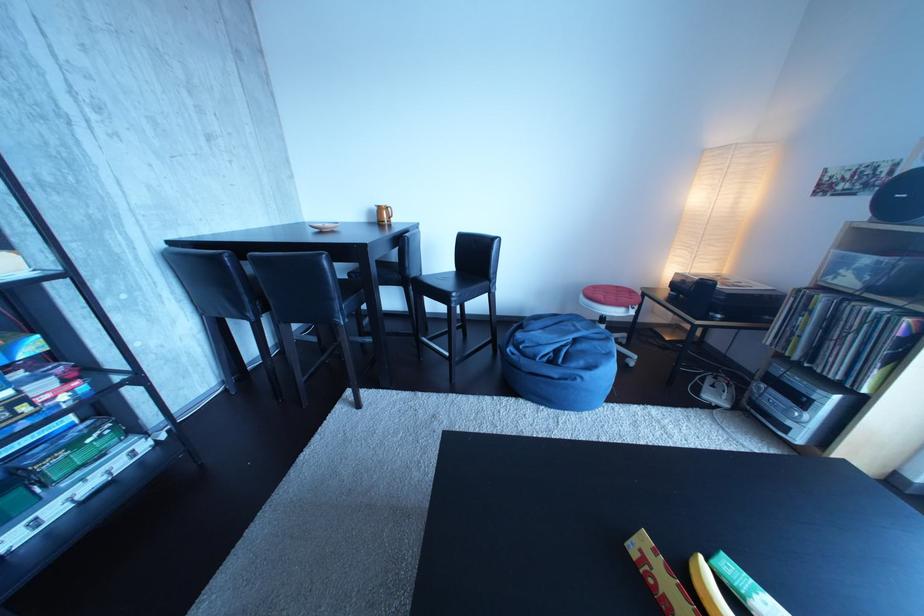
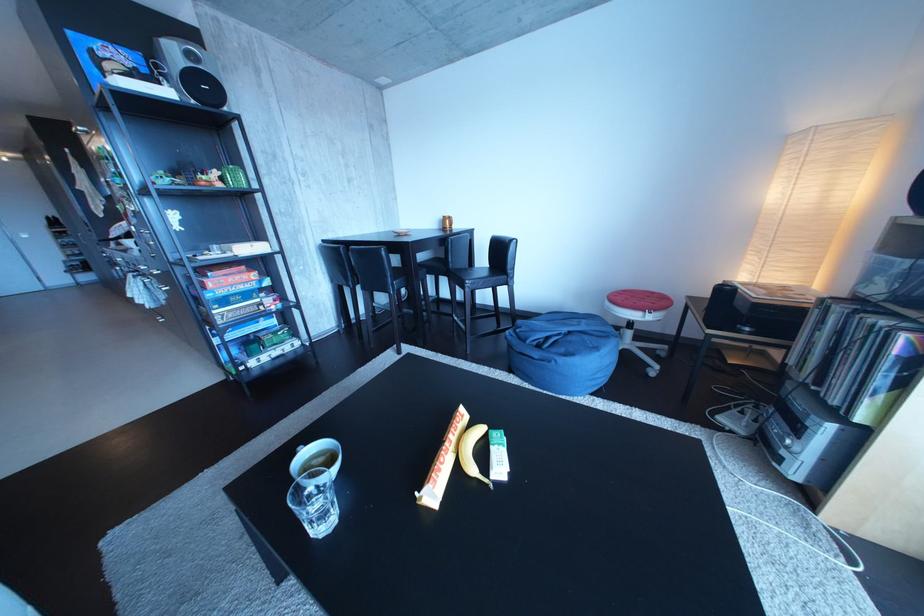
Locate, in the second image, the point that corresponds to [726,392] in the first image.

(755, 419)